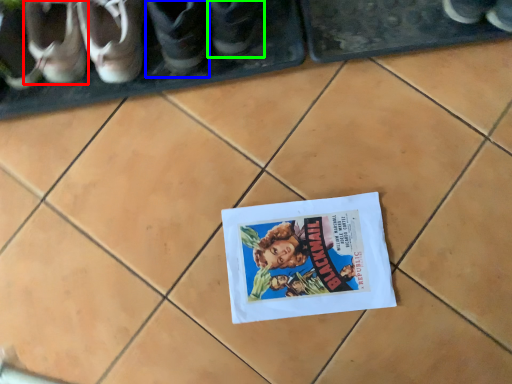
Question: Estimate the real-world distances between objects in this image. Which object is closer to footwear (highlighted by a red box), footwear (highlighted by a blue box) or footwear (highlighted by a green box)?

Choices:
 (A) footwear
 (B) footwear

Answer: (A)